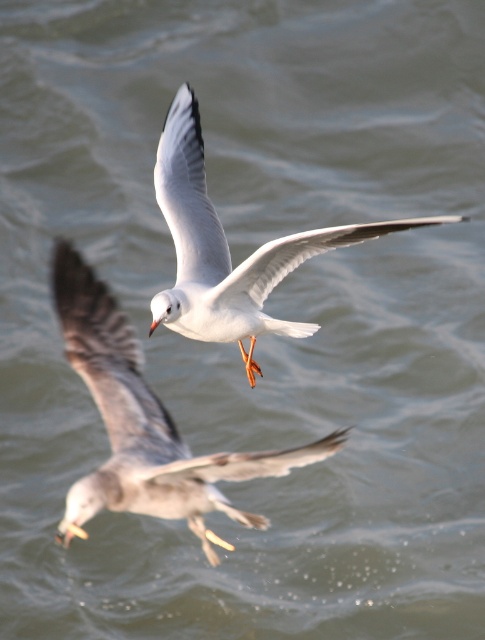
Question: Is white feathered bird at center above white matte bird at center?

Choices:
 (A) yes
 (B) no

Answer: (B)

Question: From the image, what is the correct spatial relationship of white feathered bird at center in relation to white matte bird at center?

Choices:
 (A) right
 (B) left

Answer: (B)

Question: Among these points, which one is nearest to the camera?

Choices:
 (A) (189, 513)
 (B) (212, 248)

Answer: (B)

Question: Which object appears closest to the camera in this image?

Choices:
 (A) white feathered bird at center
 (B) white matte bird at center

Answer: (B)

Question: Can you confirm if white feathered bird at center is thinner than white matte bird at center?

Choices:
 (A) no
 (B) yes

Answer: (A)